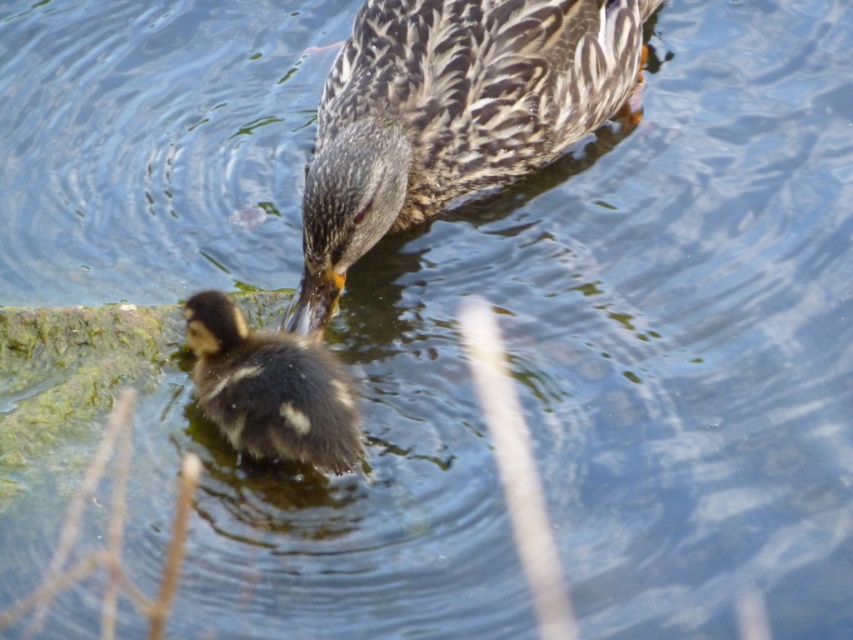
Question: Is speckled feathered duck at center wider than dark brown fluffy duckling at lower center?

Choices:
 (A) yes
 (B) no

Answer: (A)

Question: Can you confirm if speckled feathered duck at center is positioned to the left of dark brown fluffy duckling at lower center?

Choices:
 (A) yes
 (B) no

Answer: (B)

Question: Which point appears farthest from the camera in this image?

Choices:
 (A) (215, 316)
 (B) (376, 54)

Answer: (B)

Question: Is speckled feathered duck at center positioned at the back of dark brown fluffy duckling at lower center?

Choices:
 (A) no
 (B) yes

Answer: (B)